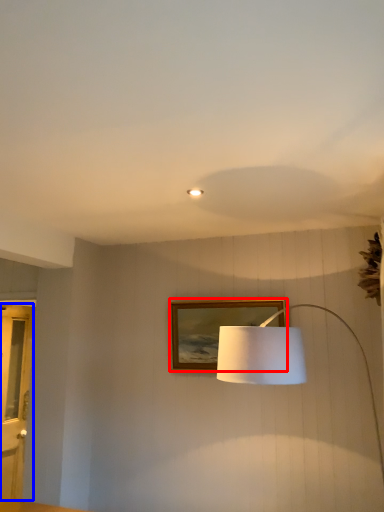
Question: Which object appears closest to the camera in this image, picture frame (highlighted by a red box) or glass door (highlighted by a blue box)?

Choices:
 (A) picture frame
 (B) glass door

Answer: (A)